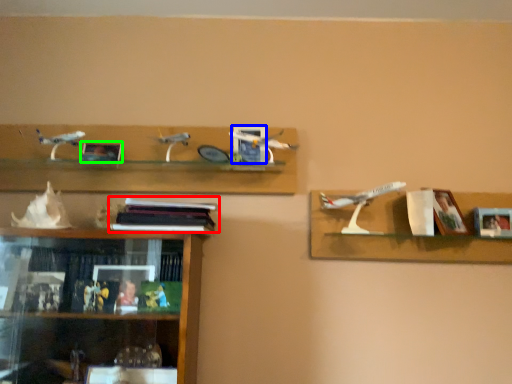
Question: Which is farther away from book (highlighted by a red box)? picture frame (highlighted by a blue box) or picture frame (highlighted by a green box)?

Choices:
 (A) picture frame
 (B) picture frame

Answer: (B)